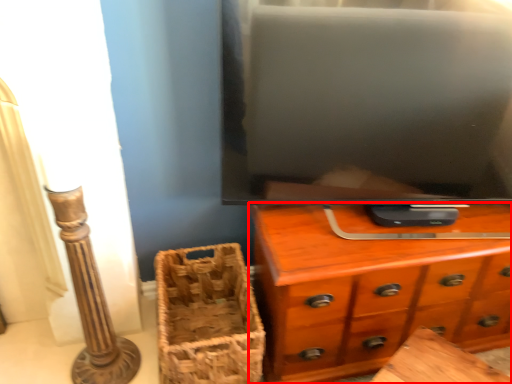
Question: In this image, where is chest of drawers (annotated by the red box) located relative to basket?

Choices:
 (A) left
 (B) right

Answer: (B)